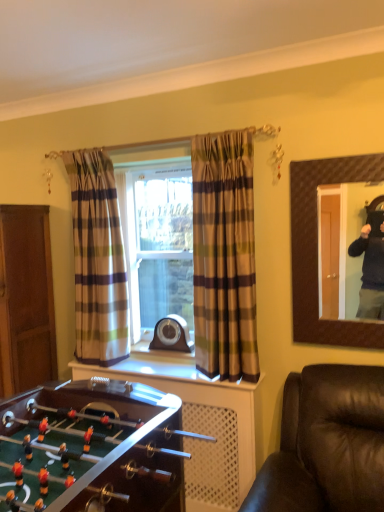
Question: From a real-world perspective, is plaid fabric curtain at left, marked as the first curtain in a left-to-right arrangement, on top of brown wooden door at left?

Choices:
 (A) no
 (B) yes

Answer: (B)

Question: Is the position of plaid fabric curtain at left, acting as the 1th curtain starting from the back, more distant than that of brown wooden door at left?

Choices:
 (A) yes
 (B) no

Answer: (B)

Question: From the image's perspective, is plaid fabric curtain at left, marked as the first curtain in a left-to-right arrangement, located beneath brown wooden door at left?

Choices:
 (A) no
 (B) yes

Answer: (A)

Question: Is plaid fabric curtain at left, which is the 2th curtain from front to back, oriented away from brown wooden door at left?

Choices:
 (A) yes
 (B) no

Answer: (B)

Question: From a real-world perspective, is plaid fabric curtain at left, which is the 2th curtain from front to back, below brown wooden door at left?

Choices:
 (A) yes
 (B) no

Answer: (B)

Question: From their relative heights in the image, would you say brown textured mirror at upper right is taller or shorter than brown wooden door at left?

Choices:
 (A) tall
 (B) short

Answer: (B)

Question: Looking at their shapes, would you say brown textured mirror at upper right is wider or thinner than brown wooden door at left?

Choices:
 (A) thin
 (B) wide

Answer: (A)

Question: In terms of size, does brown textured mirror at upper right appear bigger or smaller than brown wooden door at left?

Choices:
 (A) big
 (B) small

Answer: (B)

Question: Based on their positions, is brown textured mirror at upper right located to the left or right of brown wooden door at left?

Choices:
 (A) right
 (B) left

Answer: (A)

Question: Considering the positions of brown wooden door at left and brown textured mirror at upper right in the image, is brown wooden door at left wider or thinner than brown textured mirror at upper right?

Choices:
 (A) thin
 (B) wide

Answer: (B)

Question: From the image's perspective, is brown wooden door at left positioned above or below brown textured mirror at upper right?

Choices:
 (A) above
 (B) below

Answer: (B)

Question: From a real-world perspective, is brown wooden door at left above or below brown textured mirror at upper right?

Choices:
 (A) below
 (B) above

Answer: (A)

Question: In terms of height, does brown wooden door at left look taller or shorter compared to brown textured mirror at upper right?

Choices:
 (A) tall
 (B) short

Answer: (A)

Question: From the image's perspective, is brown wooden dresser at lower left above or below plaid fabric curtain at left, which is the 2th curtain from front to back?

Choices:
 (A) above
 (B) below

Answer: (B)

Question: Looking at the image, does brown wooden dresser at lower left seem bigger or smaller compared to plaid fabric curtain at left, which is the 2th curtain from front to back?

Choices:
 (A) big
 (B) small

Answer: (A)